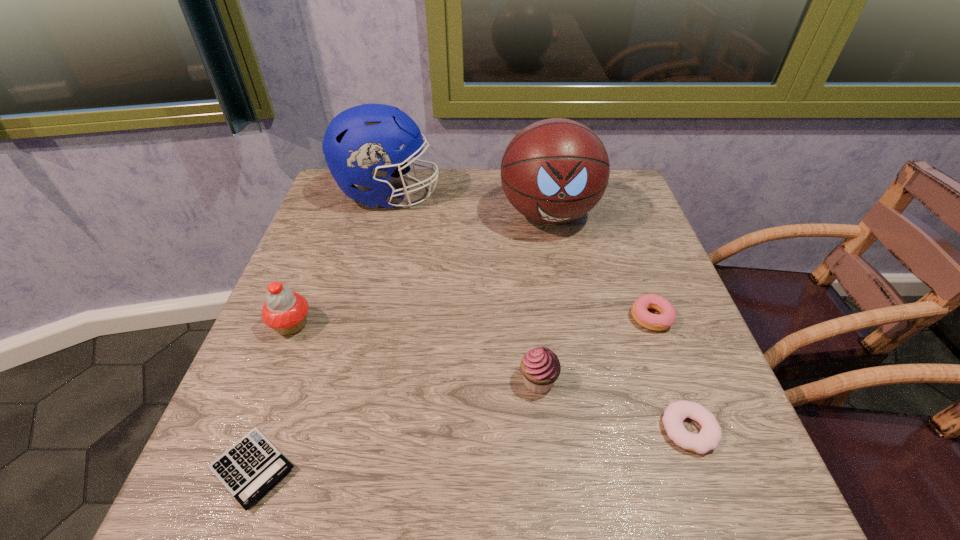
Locate an element on the screen. This screenshot has height=540, width=960. doughnut that is positioned at the near edge is located at coordinates (710, 435).

At what (x,y) coordinates should I click in order to perform the action: click on calculator located in the near edge section of the desktop. Please return your answer as a coordinate pair (x, y). Looking at the image, I should click on (252, 466).

Where is `football helmet present at the left edge`? Image resolution: width=960 pixels, height=540 pixels. football helmet present at the left edge is located at coordinates (361, 145).

This screenshot has width=960, height=540. What are the coordinates of `cupcake located at the left edge` in the screenshot? It's located at (285, 311).

At what (x,y) coordinates should I click in order to perform the action: click on calculator located at the left edge. Please return your answer as a coordinate pair (x, y). Looking at the image, I should click on (252, 466).

The height and width of the screenshot is (540, 960). I want to click on basketball present at the right edge, so click(x=554, y=171).

This screenshot has width=960, height=540. I want to click on object at the far left corner, so click(361, 145).

You are a GUI agent. You are given a task and a screenshot of the screen. Output one action in this format:
    pyautogui.click(x=<x>, y=<y>)
    Task: Click on the object positioned at the near left corner
    This screenshot has width=960, height=540.
    Given the screenshot: What is the action you would take?
    pyautogui.click(x=252, y=466)

Where is `object that is at the far right corner`? Image resolution: width=960 pixels, height=540 pixels. object that is at the far right corner is located at coordinates (554, 171).

Find the location of a particular element. The width and height of the screenshot is (960, 540). object that is positioned at the near right corner is located at coordinates (710, 435).